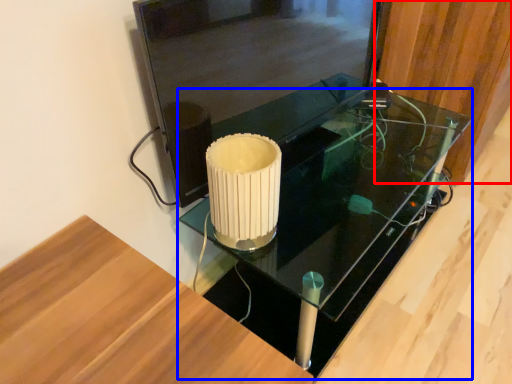
Question: Which object appears farthest to the camera in this image, wood (highlighted by a red box) or table (highlighted by a blue box)?

Choices:
 (A) wood
 (B) table

Answer: (A)